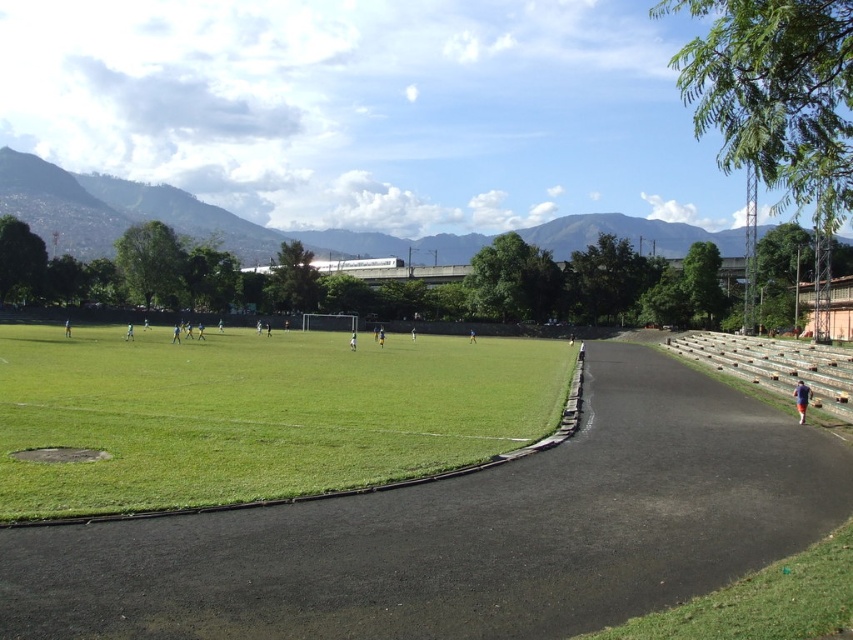
Question: Which object is farther from the camera taking this photo?

Choices:
 (A) black asphalt race track at center
 (B) green grass at center
 (C) red cotton shirt at lower right
 (D) green grass at lower right

Answer: (C)

Question: Considering the real-world distances, which object is farthest from the green grass at lower right?

Choices:
 (A) green grass at center
 (B) black asphalt race track at center
 (C) red cotton shirt at lower right

Answer: (A)

Question: Does green grass at center have a smaller size compared to red cotton shirt at lower right?

Choices:
 (A) no
 (B) yes

Answer: (A)

Question: Considering the real-world distances, which object is farthest from the green grass at lower right?

Choices:
 (A) red cotton shirt at lower right
 (B) green grass at center

Answer: (B)

Question: Does green grass at center appear under green grass at lower right?

Choices:
 (A) no
 (B) yes

Answer: (A)

Question: Is black asphalt race track at center smaller than green grass at lower right?

Choices:
 (A) no
 (B) yes

Answer: (A)